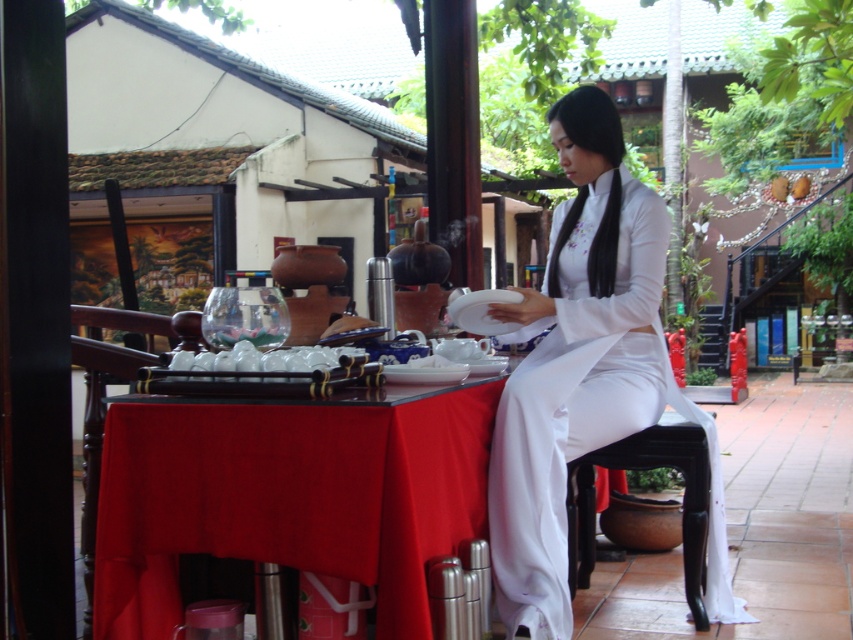
Question: Is white silk ao dai at center to the left of black wood stool at lower right from the viewer's perspective?

Choices:
 (A) no
 (B) yes

Answer: (B)

Question: Based on their relative distances, which object is nearer to the smooth red cloth at center?

Choices:
 (A) white silk ao dai at center
 (B) black wood stool at lower right

Answer: (A)

Question: Which point is closer to the camera?

Choices:
 (A) smooth red cloth at center
 (B) black wood stool at lower right
 (C) white silk ao dai at center

Answer: (A)

Question: In this image, where is white silk ao dai at center located relative to black wood stool at lower right?

Choices:
 (A) left
 (B) right

Answer: (A)

Question: Does smooth red cloth at center have a larger size compared to black wood stool at lower right?

Choices:
 (A) yes
 (B) no

Answer: (B)

Question: Which of these objects is positioned closest to the smooth red cloth at center?

Choices:
 (A) black wood stool at lower right
 (B) white silk ao dai at center

Answer: (B)